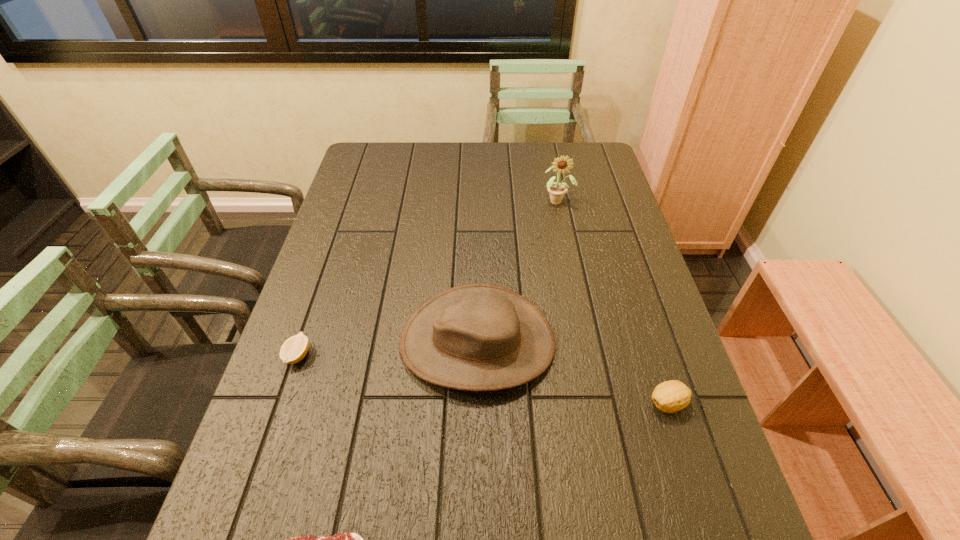
You are a GUI agent. You are given a task and a screenshot of the screen. Output one action in this format:
    pyautogui.click(x=<x>, y=<y>)
    Task: Click on the farthest object
    
    Given the screenshot: What is the action you would take?
    pyautogui.click(x=557, y=190)

Identify the location of the fourth object from left to right. (557, 190).

The height and width of the screenshot is (540, 960). Identify the location of the fourth shortest object. (474, 337).

You are a GUI agent. You are given a task and a screenshot of the screen. Output one action in this format:
    pyautogui.click(x=<x>, y=<y>)
    Task: Click on the rightmost object
    The image size is (960, 540).
    Given the screenshot: What is the action you would take?
    pyautogui.click(x=671, y=396)

Image resolution: width=960 pixels, height=540 pixels. I want to click on the nearer lemon, so click(x=671, y=396).

I want to click on the shorter lemon, so click(x=294, y=349).

Where is `the leftmost object`? The height and width of the screenshot is (540, 960). the leftmost object is located at coordinates (294, 349).

At what (x,y) coordinates should I click in order to perform the action: click on free space located on the front-facing side of the farthest object. Please return your answer as a coordinate pair (x, y). This screenshot has height=540, width=960. Looking at the image, I should click on (567, 251).

Identify the location of vacant space located on the back of the cowboy hat. (478, 202).

I want to click on blank area located at the stem end of the third shortest object, so click(601, 403).